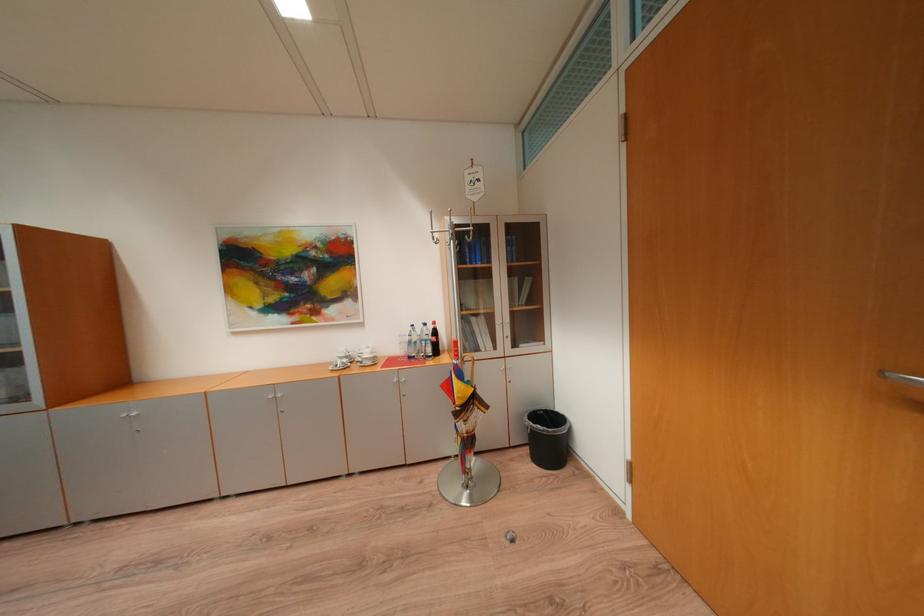
Where is `clear water bottle`? clear water bottle is located at coordinates (424, 341).